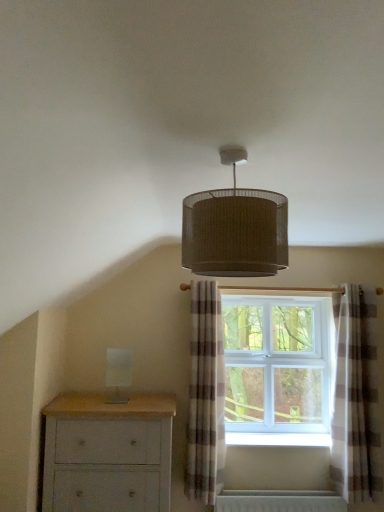
This screenshot has width=384, height=512. I want to click on empty space that is ontop of matte brown fabric lampshade at center (from a real-world perspective), so click(x=247, y=150).